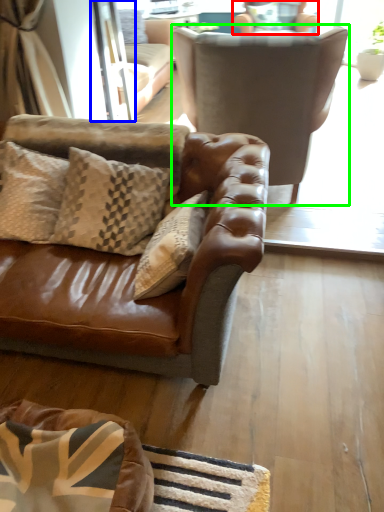
Question: Based on their relative distances, which object is nearer to chair (highlighted by a red box)? Choose from screen door (highlighted by a blue box) and chair (highlighted by a green box).

Choices:
 (A) screen door
 (B) chair

Answer: (B)